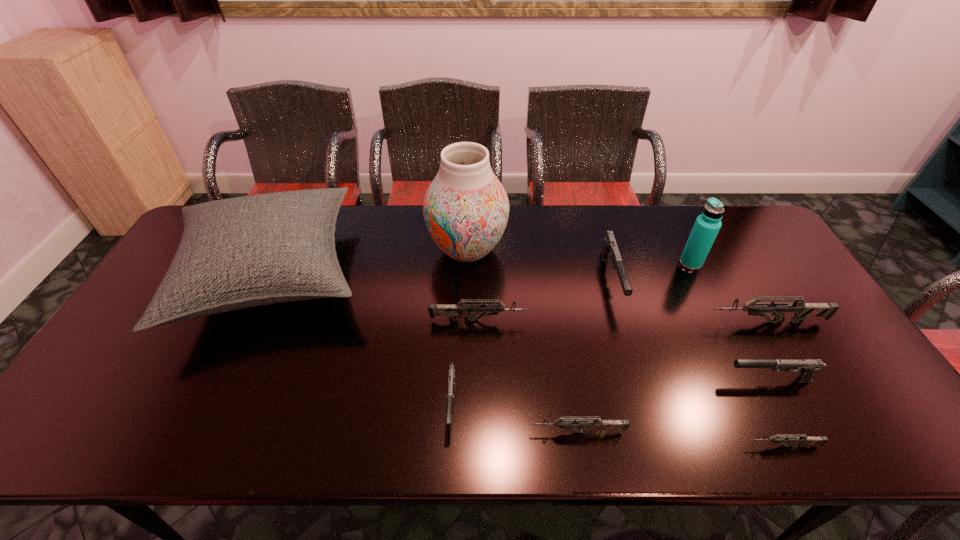
At what (x,y) coordinates should I click in order to perform the action: click on vase. Please return your answer as a coordinate pair (x, y). This screenshot has height=540, width=960. Looking at the image, I should click on (466, 208).

Where is `blue water bottle`? This screenshot has height=540, width=960. blue water bottle is located at coordinates (706, 227).

Identify the location of the leftmost object. (242, 252).

The width and height of the screenshot is (960, 540). What are the coordinates of `the fourth gun from left to right` in the screenshot? It's located at (610, 249).

Identify the location of the farthest gun. (610, 249).

Locate an element on the screen. the biggest grey gun is located at coordinates (802, 310).

At what (x,y) coordinates should I click in order to perform the action: click on the third smallest grey gun. Please return your answer as a coordinate pair (x, y). Image resolution: width=960 pixels, height=540 pixels. Looking at the image, I should click on (451, 310).

Locate an element on the screen. The image size is (960, 540). the second biggest gray gun is located at coordinates (806, 368).

Find the location of a particular element. This screenshot has height=540, width=960. the second nearest grey gun is located at coordinates (585, 423).

At what (x,y) coordinates should I click in order to perform the action: click on the smallest gray gun. Please return your answer as a coordinate pair (x, y). Image resolution: width=960 pixels, height=540 pixels. Looking at the image, I should click on (451, 372).